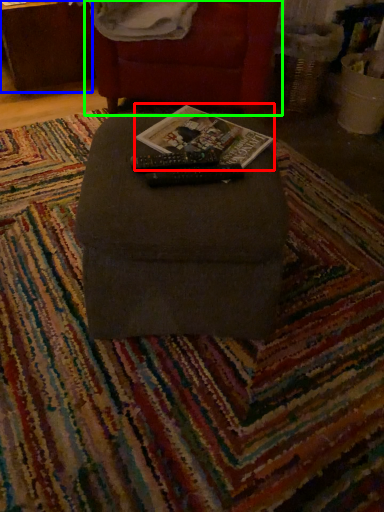
Question: Which is nearer to the magazine (highlighted by a red box)? table (highlighted by a blue box) or furniture (highlighted by a green box).

Choices:
 (A) table
 (B) furniture

Answer: (B)